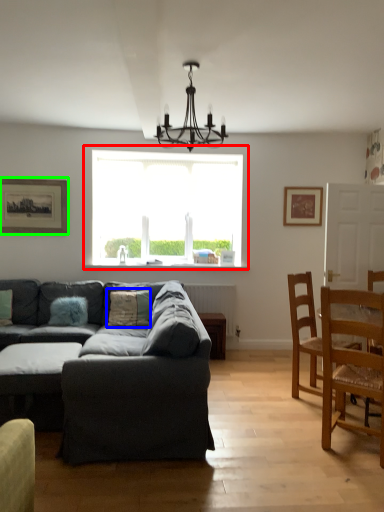
Question: Based on their relative distances, which object is nearer to window (highlighted by a red box)? Choose from pillow (highlighted by a blue box) and picture frame (highlighted by a green box).

Choices:
 (A) pillow
 (B) picture frame

Answer: (B)